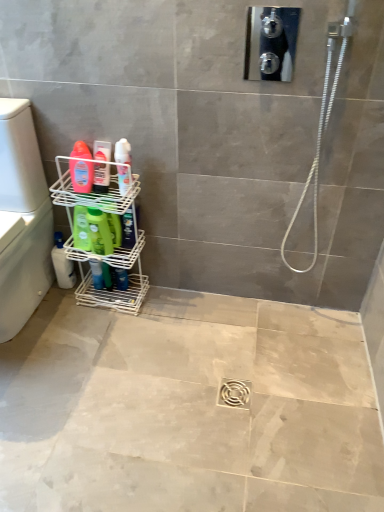
The height and width of the screenshot is (512, 384). I want to click on matte pink bottle at left, which ranks as the second cleaning product in left-to-right order, so click(x=81, y=175).

Measure the distance between point (98, 246) and camera.

They are 1.68 meters apart.

This screenshot has width=384, height=512. What do you see at coordinates (62, 264) in the screenshot?
I see `green matte bottle at left, which is the 3th cleaning product from right to left` at bounding box center [62, 264].

Measure the distance between translucent plastic bottle at left, the first toiletry from the left, and camera.

The distance of translucent plastic bottle at left, the first toiletry from the left, from camera is 4.94 feet.

The image size is (384, 512). Identify the location of translucent plastic bottle at left, the first toiletry from the left. (101, 177).

Where is `white glossy spray can at upper center, marked as the first toiletry in a right-to-left arrangement`? This screenshot has width=384, height=512. white glossy spray can at upper center, marked as the first toiletry in a right-to-left arrangement is located at coordinates (123, 152).

The height and width of the screenshot is (512, 384). Describe the element at coordinates (22, 219) in the screenshot. I see `white plastic washer at left` at that location.

Find the location of a particular element. This screenshot has width=384, height=512. matte pink bottle at left, the second cleaning product when ordered from right to left is located at coordinates (81, 175).

Are matte pink bottle at left, which ranks as the second cleaning product in left-to-right order, and white plastic washer at left far apart?

No, there isn't a large distance between matte pink bottle at left, which ranks as the second cleaning product in left-to-right order, and white plastic washer at left.

Does point (81, 167) come farther from viewer compared to point (2, 297)?

No, it is in front of (2, 297).

Who is bigger, white glossy spray can at upper center, marked as the first toiletry in a right-to-left arrangement, or translucent plastic bottle at left, the first toiletry from the left?

translucent plastic bottle at left, the first toiletry from the left.

Which is behind, point (123, 184) or point (94, 181)?

The point (123, 184) is more distant.

Is white glossy spray can at upper center, which appears as the 2th toiletry when viewed from the left, located outside translucent plastic bottle at left, the first toiletry from the left?

Yes, white glossy spray can at upper center, which appears as the 2th toiletry when viewed from the left, is located beyond the bounds of translucent plastic bottle at left, the first toiletry from the left.

How different are the orientations of green matte bottle at lower left, arranged as the second cleaning product when viewed from the front, and silver metallic hose at upper right in degrees?

They differ by 2.48 degrees in their facing directions.

Is green matte bottle at lower left, placed as the 1th cleaning product when sorted from right to left, directly adjacent to silver metallic hose at upper right?

No, green matte bottle at lower left, placed as the 1th cleaning product when sorted from right to left, is not beside silver metallic hose at upper right.

From a real-world perspective, is green matte bottle at lower left, arranged as the second cleaning product when viewed from the front, physically located above or below silver metallic hose at upper right?

green matte bottle at lower left, arranged as the second cleaning product when viewed from the front, is below silver metallic hose at upper right.

From the image's perspective, is matte pink bottle at left, the third cleaning product when ordered from back to front, above or below white glossy spray can at upper center, which appears as the 2th toiletry when viewed from the left?

matte pink bottle at left, the third cleaning product when ordered from back to front, is above white glossy spray can at upper center, which appears as the 2th toiletry when viewed from the left.

Does matte pink bottle at left, the third cleaning product when ordered from back to front, appear on the right side of white glossy spray can at upper center, which appears as the 2th toiletry when viewed from the left?

In fact, matte pink bottle at left, the third cleaning product when ordered from back to front, is to the left of white glossy spray can at upper center, which appears as the 2th toiletry when viewed from the left.

Looking at their sizes, would you say matte pink bottle at left, acting as the 1th cleaning product starting from the top, is wider or thinner than white glossy spray can at upper center, which appears as the 2th toiletry when viewed from the left?

In the image, matte pink bottle at left, acting as the 1th cleaning product starting from the top, appears to be wider than white glossy spray can at upper center, which appears as the 2th toiletry when viewed from the left.

Is matte pink bottle at left, which appears as the 3th cleaning product when ordered from the bottom, facing towards green matte bottle at left, which ranks as the third cleaning product in front-to-back order?

No.

Considering the sizes of objects matte pink bottle at left, which ranks as the second cleaning product in left-to-right order, and green matte bottle at left, which is the third cleaning product from top to bottom, in the image provided, who is bigger, matte pink bottle at left, which ranks as the second cleaning product in left-to-right order, or green matte bottle at left, which is the third cleaning product from top to bottom,?

With larger size is green matte bottle at left, which is the third cleaning product from top to bottom.

Where is `the 2nd cleaning product in front of the green matte bottle at left, which is the 3th cleaning product from right to left, counting from the anchor's position`? the 2nd cleaning product in front of the green matte bottle at left, which is the 3th cleaning product from right to left, counting from the anchor's position is located at coordinates (81, 175).

From a real-world perspective, which object stands above the other?

From a 3D spatial view, matte pink bottle at left, the second cleaning product when ordered from right to left, is above.

Is point (104, 184) more distant than point (18, 159)?

Yes, point (104, 184) is farther from viewer.

From the image's perspective, starting from the white plastic washer at left, which toiletry is the 2nd one above? Please provide its 2D coordinates.

[(101, 177)]

Considering the positions of objects translucent plastic bottle at left, arranged as the second toiletry when viewed from the right, and white plastic washer at left in the image provided, who is more to the left, translucent plastic bottle at left, arranged as the second toiletry when viewed from the right, or white plastic washer at left?

white plastic washer at left.

From a real-world perspective, is translucent plastic bottle at left, arranged as the second toiletry when viewed from the right, below white plastic washer at left?

Actually, translucent plastic bottle at left, arranged as the second toiletry when viewed from the right, is physically above white plastic washer at left in the real world.

What's the angular difference between silver metallic hose at upper right and green matte bottle at left, the first cleaning product in the left-to-right sequence,'s facing directions?

The angular difference between silver metallic hose at upper right and green matte bottle at left, the first cleaning product in the left-to-right sequence, is 2.96 degrees.

Are silver metallic hose at upper right and green matte bottle at left, which is the third cleaning product from top to bottom, beside each other?

They are not placed beside each other.

Is silver metallic hose at upper right oriented towards green matte bottle at left, which ranks as the third cleaning product in front-to-back order?

No, silver metallic hose at upper right is not turned towards green matte bottle at left, which ranks as the third cleaning product in front-to-back order.

Identify the location of washer that appears in front of the matte pink bottle at left, the second cleaning product when ordered from right to left. (22, 219).

The image size is (384, 512). I want to click on toiletry below the translucent plastic bottle at left, arranged as the second toiletry when viewed from the right (from the image's perspective), so click(123, 152).

When comparing their distances from white glossy spray can at upper center, marked as the first toiletry in a right-to-left arrangement, does translucent plastic bottle at left, the first toiletry from the left, or white wire shelf at lower left seem closer?

Among the two, translucent plastic bottle at left, the first toiletry from the left, is located nearer to white glossy spray can at upper center, marked as the first toiletry in a right-to-left arrangement.

Which object lies further to the anchor point white plastic washer at left, silver metallic hose at upper right or translucent plastic bottle at left, arranged as the second toiletry when viewed from the right?

Based on the image, silver metallic hose at upper right appears to be further to white plastic washer at left.

When comparing their distances from silver metallic hose at upper right, does white glossy spray can at upper center, which appears as the 2th toiletry when viewed from the left, or translucent plastic bottle at left, arranged as the second toiletry when viewed from the right, seem further?

Among the two, translucent plastic bottle at left, arranged as the second toiletry when viewed from the right, is located further to silver metallic hose at upper right.

When comparing their distances from green matte bottle at left, the first cleaning product in the left-to-right sequence, does matte pink bottle at left, acting as the 1th cleaning product starting from the top, or white wire shelf at lower left seem closer?

white wire shelf at lower left is positioned closer to the anchor green matte bottle at left, the first cleaning product in the left-to-right sequence.

Based on the photo, which object lies further to the anchor point silver metallic hose at upper right, translucent plastic bottle at left, arranged as the second toiletry when viewed from the right, or green matte bottle at lower left, the 2th cleaning product in the bottom-to-top sequence?

green matte bottle at lower left, the 2th cleaning product in the bottom-to-top sequence, is positioned further to the anchor silver metallic hose at upper right.

Estimate the real-world distances between objects in this image. Which object is further from silver metallic hose at upper right, translucent plastic bottle at left, the first toiletry from the left, or white plastic washer at left?

The object further to silver metallic hose at upper right is white plastic washer at left.

Considering their positions, is translucent plastic bottle at left, arranged as the second toiletry when viewed from the right, positioned further to silver metallic hose at upper right than white wire shelf at lower left?

translucent plastic bottle at left, arranged as the second toiletry when viewed from the right, is further to silver metallic hose at upper right.

From the image, which object appears to be nearer to translucent plastic bottle at left, the first toiletry from the left, white wire shelf at lower left or white plastic washer at left?

white wire shelf at lower left lies closer to translucent plastic bottle at left, the first toiletry from the left, than the other object.

At what (x,y) coordinates should I click in order to perform the action: click on cleaning product between white glossy spray can at upper center, marked as the first toiletry in a right-to-left arrangement, and green matte bottle at left, which ranks as the third cleaning product in front-to-back order, vertically. Please return your answer as a coordinate pair (x, y). The width and height of the screenshot is (384, 512). Looking at the image, I should click on (99, 231).

This screenshot has height=512, width=384. What are the coordinates of `cleaning product positioned between white plastic washer at left and green matte bottle at lower left, which is the second cleaning product in top-to-bottom order, from near to far` in the screenshot? It's located at (81, 175).

I want to click on toiletry situated between translucent plastic bottle at left, arranged as the second toiletry when viewed from the right, and silver metallic hose at upper right from left to right, so click(x=123, y=152).

Where is `shelf positioned between white plastic washer at left and green matte bottle at lower left, the third cleaning product viewed from the left, from near to far`? The width and height of the screenshot is (384, 512). shelf positioned between white plastic washer at left and green matte bottle at lower left, the third cleaning product viewed from the left, from near to far is located at coordinates (114, 267).